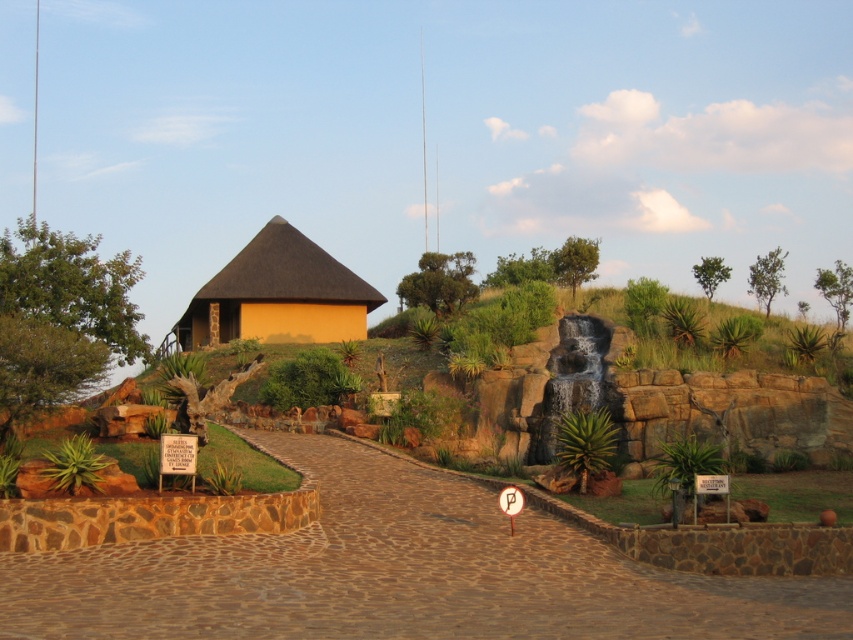
Question: Where is brown cobblestone path at center located in relation to matte yellow thatched hut at center in the image?

Choices:
 (A) above
 (B) below

Answer: (B)

Question: Does brown cobblestone path at center appear on the right side of matte yellow thatched hut at center?

Choices:
 (A) no
 (B) yes

Answer: (B)

Question: Is brown cobblestone path at center positioned in front of matte yellow thatched hut at center?

Choices:
 (A) no
 (B) yes

Answer: (B)